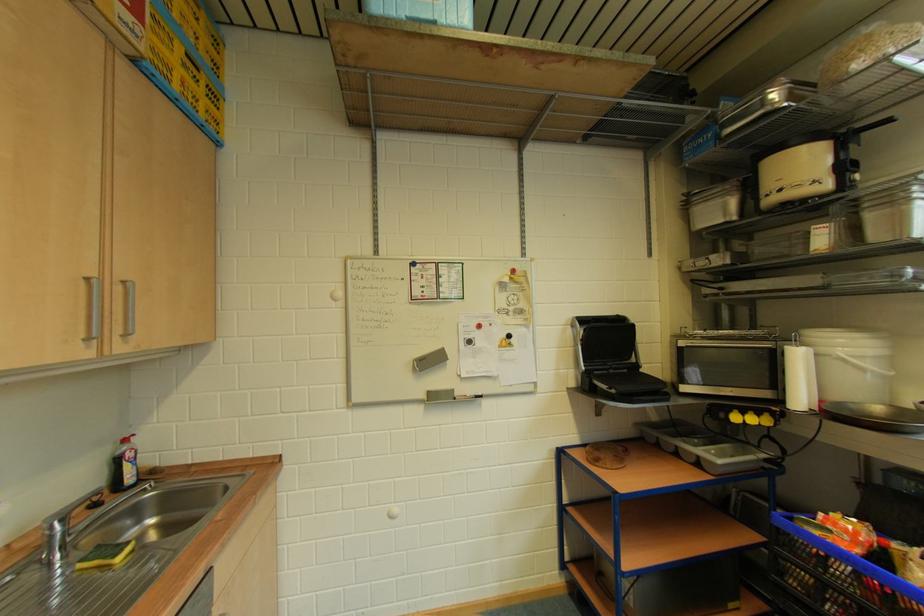
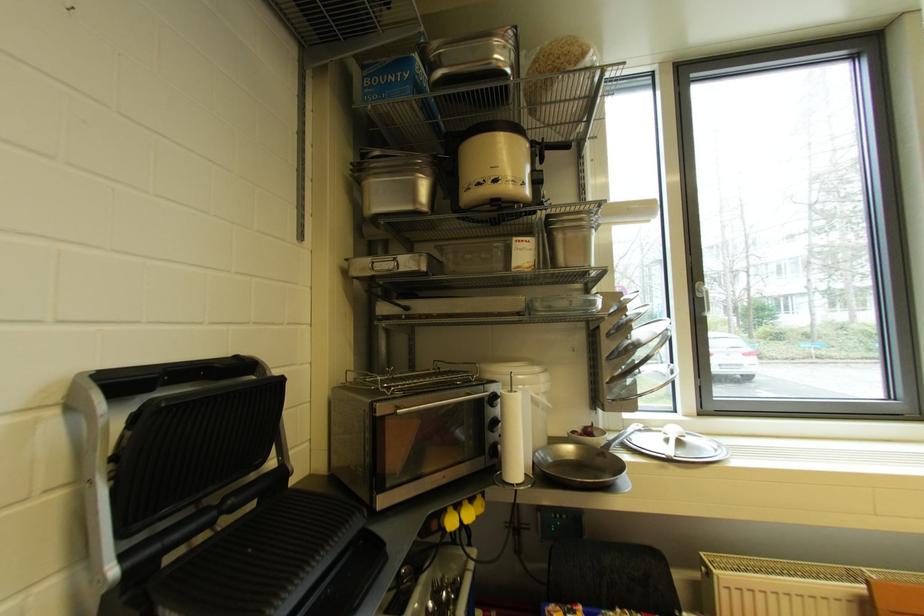
The point at (709, 265) is marked in the first image. Where is the corresponding point in the second image?

(392, 269)